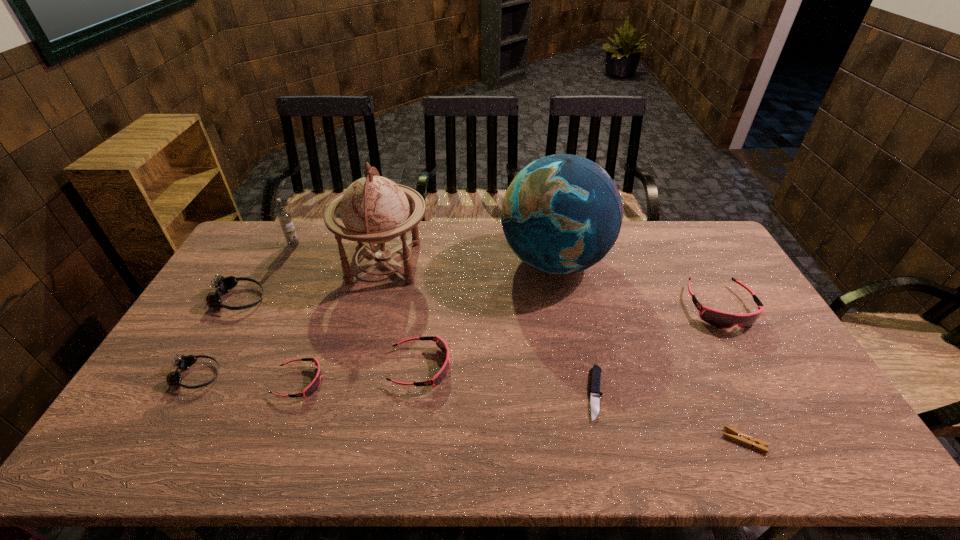
Where is `vacant area in the image that satisfies the following two spatial constraints: 1. on the label of the third tallest object; 2. through the lenses of the nearer bronze goggles`? The width and height of the screenshot is (960, 540). vacant area in the image that satisfies the following two spatial constraints: 1. on the label of the third tallest object; 2. through the lenses of the nearer bronze goggles is located at coordinates (227, 376).

Locate an element on the screen. Image resolution: width=960 pixels, height=540 pixels. vacant area in the image that satisfies the following two spatial constraints: 1. on the front-facing side of the clothespin; 2. on the left side of the second pink goggles from left to right is located at coordinates (412, 441).

I want to click on blank area in the image that satisfies the following two spatial constraints: 1. on the label of the steak knife; 2. on the left side of the vodka, so click(x=217, y=394).

Find the location of a particular element. The height and width of the screenshot is (540, 960). free space that satisfies the following two spatial constraints: 1. on the front-facing side of the nearest object; 2. on the left side of the second pink goggles from left to right is located at coordinates (412, 441).

Image resolution: width=960 pixels, height=540 pixels. I want to click on vacant region that satisfies the following two spatial constraints: 1. on the front side of the blue globe; 2. on the right side of the steak knife, so click(x=580, y=394).